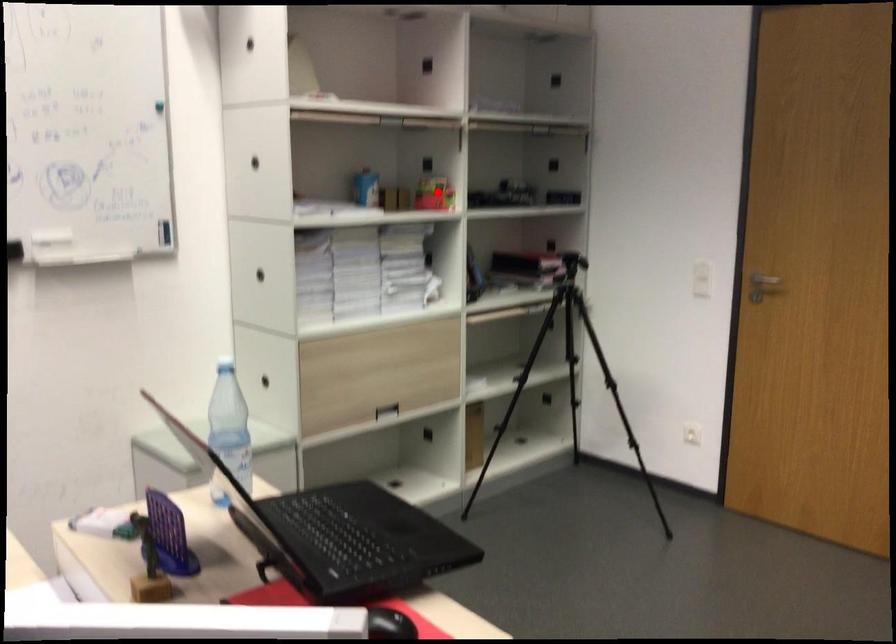
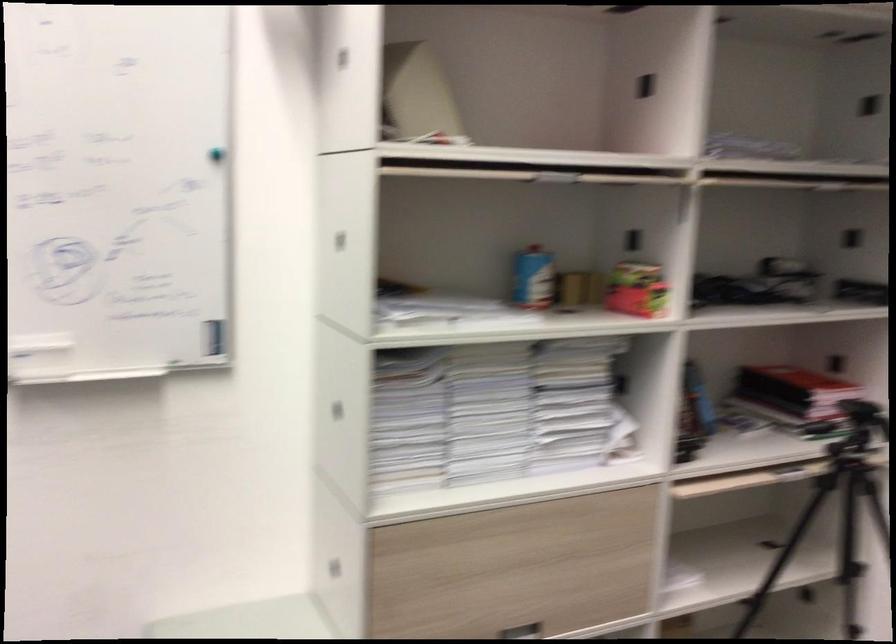
Question: A red point is marked in image1. In image2, is the corresponding 3D point closer to the camera or farther? Reply with the corresponding letter.

Choices:
 (A) The corresponding 3D point is closer.
 (B) The corresponding 3D point is farther.

Answer: (A)